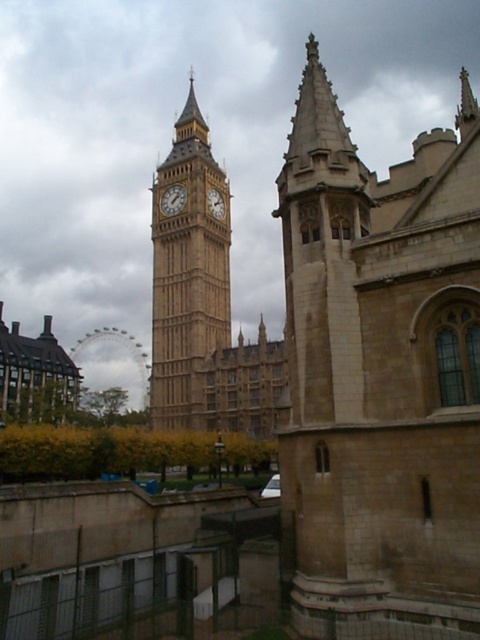
Question: Is golden stone clock tower at center closer to camera compared to golden stone clock tower at center-left?

Choices:
 (A) yes
 (B) no

Answer: (A)

Question: Is golden stone clock tower at center wider than golden stone clock tower at center-left?

Choices:
 (A) no
 (B) yes

Answer: (B)

Question: Which object is farther from the camera taking this photo?

Choices:
 (A) gold textured clock at center
 (B) golden stone clock tower at center

Answer: (A)

Question: Does golden stone clock tower at center have a lesser width compared to golden stone clock tower at center-left?

Choices:
 (A) yes
 (B) no

Answer: (B)

Question: Which object is positioned farthest from the golden stone clock tower at center-left?

Choices:
 (A) golden stone clock tower at center
 (B) beige stone tower at upper right
 (C) gold textured clock at center

Answer: (B)

Question: Which point is closer to the camera?

Choices:
 (A) (210, 200)
 (B) (168, 204)

Answer: (A)